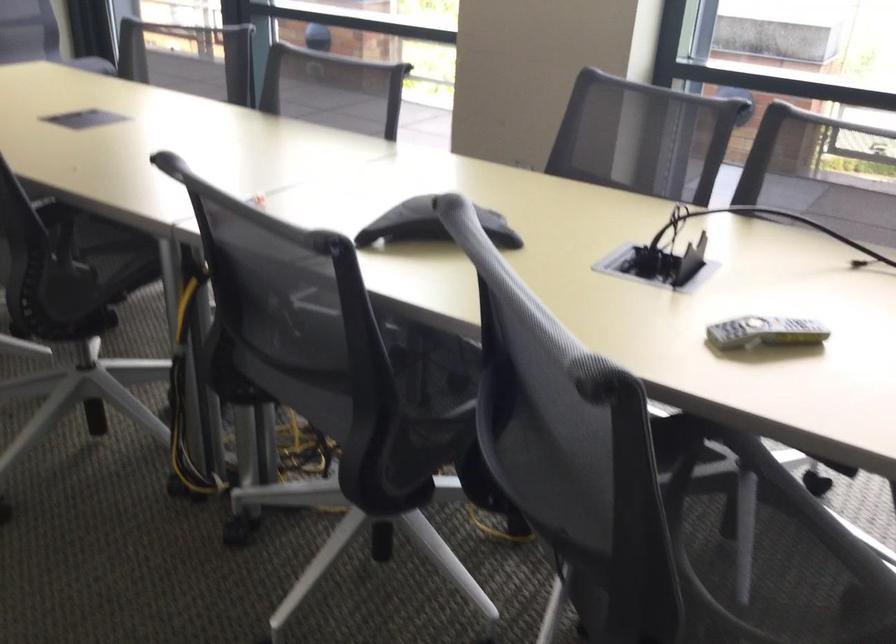
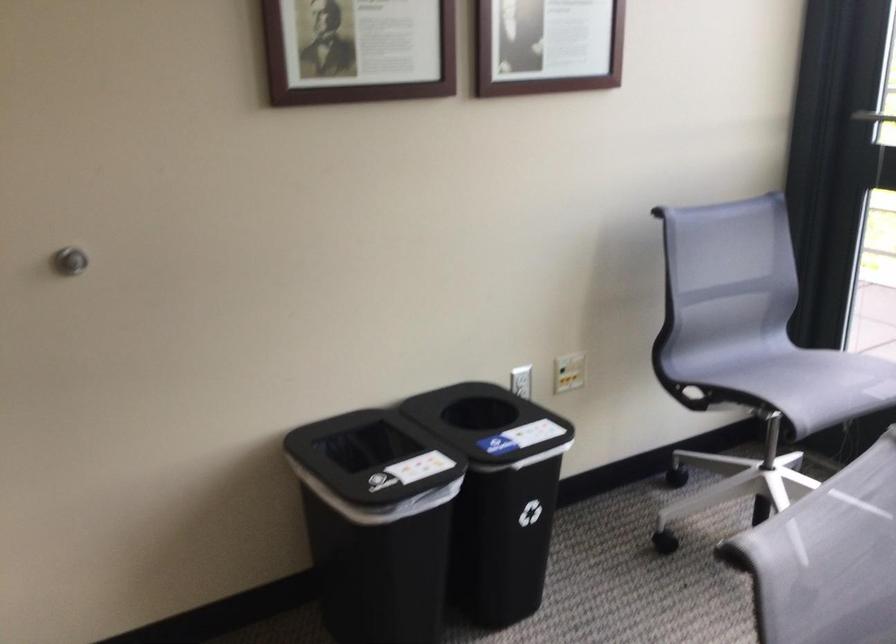
Which direction would the cameraman need to move to produce the second image?

The movement direction of the cameraman is left, forward.